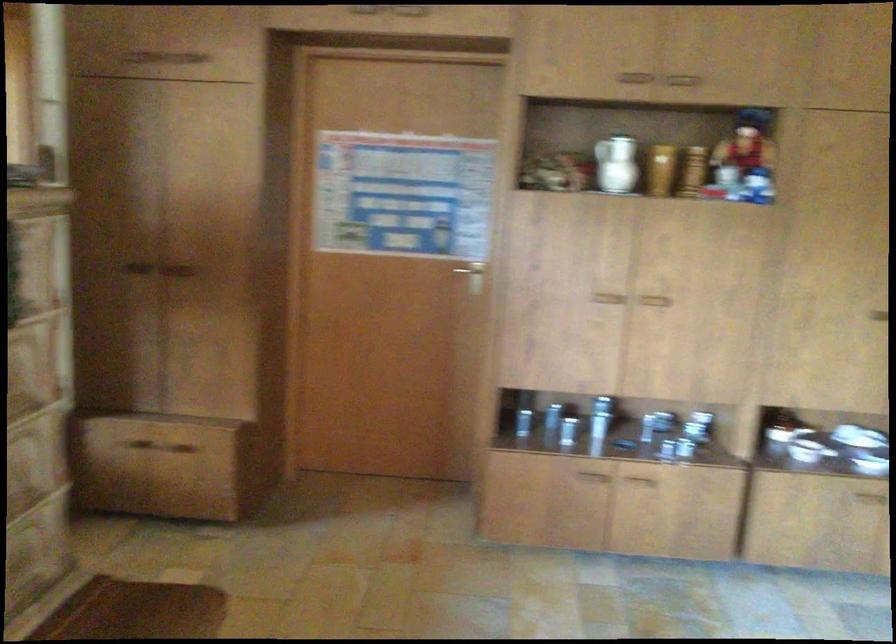
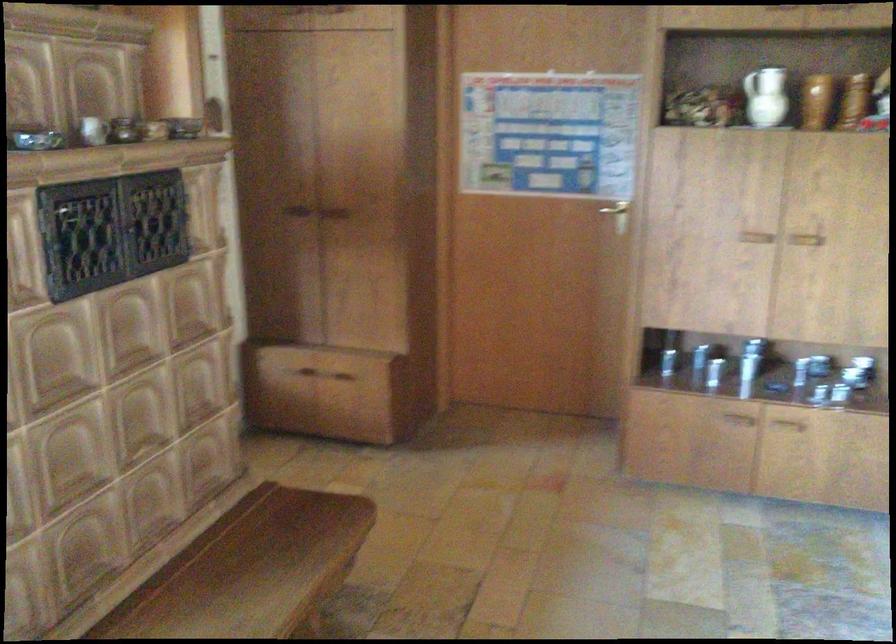
Question: I am providing you with two images of the same scene from different viewpoints. Please identify which objects are invisible in image2.

Choices:
 (A) gold door handle
 (B) white mug
 (C) wooden bench surface
 (D) none of these

Answer: (D)